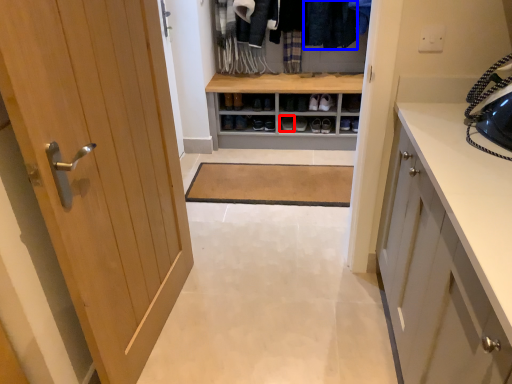
Question: Among these objects, which one is nearest to the camera, footwear (highlighted by a red box) or clothing (highlighted by a blue box)?

Choices:
 (A) footwear
 (B) clothing

Answer: (B)